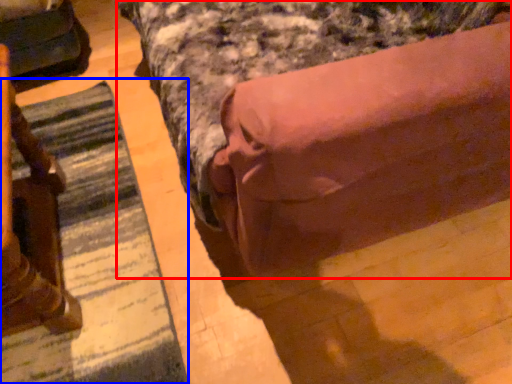
Question: Which of the following is the closest to the observer, bed (highlighted by a red box) or mat (highlighted by a blue box)?

Choices:
 (A) bed
 (B) mat

Answer: (A)